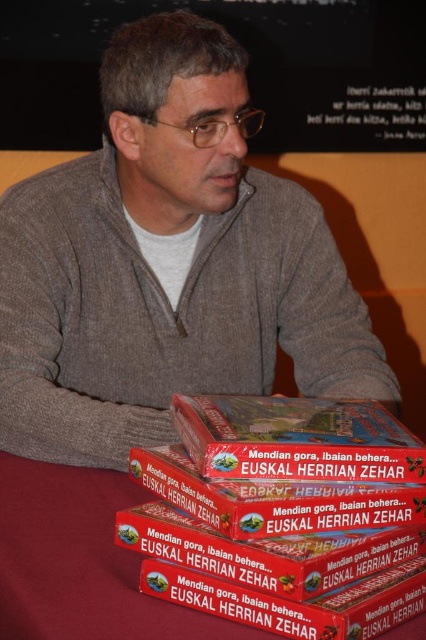
You are a photographer standing 1 meter away from the man. You want to take a closeup shot of the point at coordinates point (383, 497). Will you need to move closer or farther away to focus on that point?

The distance of point (383, 497) from camera is 59.14 centimeters. Since you are currently 1 meter away, you need to move 40.86 centimeters closer to reach the point.

You are a photographer setting up for a photo shoot. You need to place a small lamp on the table near the brown cardboard boxes at lower center to light up the scene. Given the current setup, where exactly should you position the lamp relative to the boxes?

The brown cardboard boxes at lower center are located at point (80, 561), so you should position the lamp near that coordinate to effectively light up the scene.

You are a delivery person who just arrived at the scene. You need to place a package that is 50 centimeters long onto the brown cardboard boxes at lower center. Is there enough space between you and the boxes to safely place the package?

The distance between the brown cardboard boxes at lower center and the viewer is 53.84 centimeters. Since the package is 50 centimeters long, there is sufficient space to safely place the package as the distance exceeds the package length.